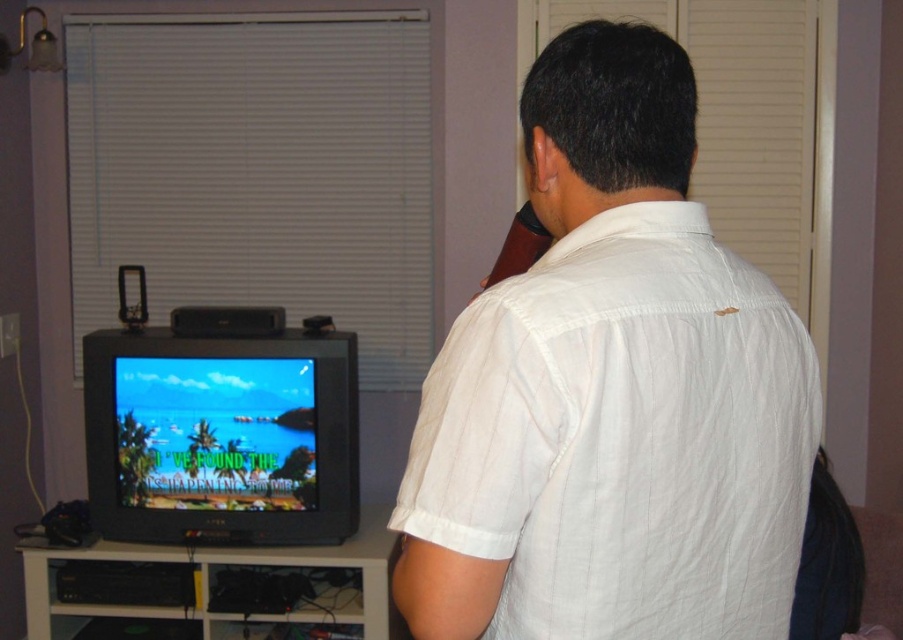
You are a photographer taking a picture of the white cotton shirt at back and the white wood entertainment center at lower left. Which object should you focus on first to ensure both are in sharp focus?

You should focus on the white wood entertainment center at lower left first because it is farther away from the viewer than the white cotton shirt at back. By focusing on the farther object, the closer object will also be in focus due to the depth of field.